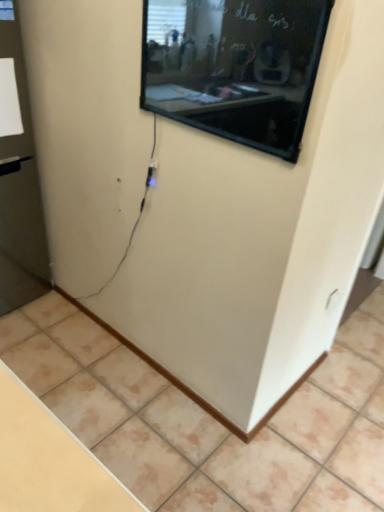
This screenshot has height=512, width=384. Describe the element at coordinates (20, 196) in the screenshot. I see `transparent glass door at left` at that location.

In order to face black glossy screen at upper center, should I rotate leftwards or rightwards?

To face it directly, rotate right by 2.546 degrees.

The width and height of the screenshot is (384, 512). I want to click on transparent glass door at left, so click(x=20, y=196).

Can black glossy screen at upper center be found inside transparent glass door at left?

No, black glossy screen at upper center is not surrounded by transparent glass door at left.

In the scene shown: Can you tell me how much transparent glass door at left and black glossy screen at upper center differ in facing direction?

They differ by 88.2 degrees in their facing directions.

From a real-world perspective, is transparent glass door at left above or below black glossy screen at upper center?

In terms of real-world spatial position, transparent glass door at left is below black glossy screen at upper center.

Does transparent glass door at left have a lesser width compared to black glossy screen at upper center?

No, transparent glass door at left is not thinner than black glossy screen at upper center.

Which of these two, black glossy screen at upper center or transparent glass door at left, is smaller?

Smaller between the two is black glossy screen at upper center.

From the image's perspective, between black glossy screen at upper center and transparent glass door at left, who is located below?

transparent glass door at left, from the image's perspective.

Is black glossy screen at upper center not inside transparent glass door at left?

Yes, black glossy screen at upper center is not within transparent glass door at left.

Does point (216, 65) lie in front of point (2, 247)?

Yes.

Considering the relative positions of black glossy screen at upper center and beige tile at lower center in the image provided, is black glossy screen at upper center in front of beige tile at lower center?

Yes, black glossy screen at upper center is closer to the viewer.

Is point (250, 11) more distant than point (194, 419)?

No, (250, 11) is in front of (194, 419).

Would you say black glossy screen at upper center contains beige tile at lower center?

No, beige tile at lower center is not inside black glossy screen at upper center.

Looking at this image, is black glossy screen at upper center taller or shorter than beige tile at lower center?

black glossy screen at upper center is taller than beige tile at lower center.

Does point (80, 405) come farther from viewer compared to point (10, 169)?

No.

Is beige tile at lower center next to transparent glass door at left?

beige tile at lower center is not next to transparent glass door at left, and they're not touching.

Measure the distance from beige tile at lower center to transparent glass door at left.

The distance of beige tile at lower center from transparent glass door at left is 35.17 inches.

Locate an element on the screen. This screenshot has height=512, width=384. glass door behind the beige tile at lower center is located at coordinates (20, 196).

From the image's perspective, is transparent glass door at left beneath beige tile at lower center?

Incorrect, from the image's perspective, transparent glass door at left is higher than beige tile at lower center.

How far apart are transparent glass door at left and beige tile at lower center?

transparent glass door at left and beige tile at lower center are 35.17 inches apart from each other.

From a real-world perspective, who is located lower, transparent glass door at left or beige tile at lower center?

From a 3D spatial view, beige tile at lower center is below.

Is transparent glass door at left not close to beige tile at lower center?

Actually, transparent glass door at left and beige tile at lower center are a little close together.

From the image's perspective, which is above, beige tile at lower center or black glossy screen at upper center?

black glossy screen at upper center appears higher in the image.

Can you confirm if beige tile at lower center is wider than black glossy screen at upper center?

Yes.

Between beige tile at lower center and black glossy screen at upper center, which one is positioned in front?

black glossy screen at upper center.

Is beige tile at lower center positioned beyond the bounds of black glossy screen at upper center?

Indeed, beige tile at lower center is completely outside black glossy screen at upper center.

Find the location of `glass door on the left of black glossy screen at upper center`. glass door on the left of black glossy screen at upper center is located at coordinates (20, 196).

This screenshot has width=384, height=512. In order to click on projection screen that appears above the transparent glass door at left (from the image's perspective) in this screenshot , I will do `click(235, 67)`.

Considering their positions, is beige tile at lower center positioned closer to transparent glass door at left than black glossy screen at upper center?

beige tile at lower center lies closer to transparent glass door at left than the other object.

Estimate the real-world distances between objects in this image. Which object is closer to beige tile at lower center, transparent glass door at left or black glossy screen at upper center?

The object closer to beige tile at lower center is transparent glass door at left.

Looking at this image, estimate the real-world distances between objects in this image. Which object is further from black glossy screen at upper center, transparent glass door at left or beige tile at lower center?

beige tile at lower center lies further to black glossy screen at upper center than the other object.

From the image, which object appears to be nearer to black glossy screen at upper center, beige tile at lower center or transparent glass door at left?

transparent glass door at left is positioned closer to the anchor black glossy screen at upper center.

When comparing their distances from transparent glass door at left, does black glossy screen at upper center or beige tile at lower center seem closer?

beige tile at lower center lies closer to transparent glass door at left than the other object.

Considering their positions, is black glossy screen at upper center positioned closer to beige tile at lower center than transparent glass door at left?

transparent glass door at left.

At what (x,y) coordinates should I click in order to perform the action: click on projection screen between transparent glass door at left and beige tile at lower center. Please return your answer as a coordinate pair (x, y). This screenshot has width=384, height=512. Looking at the image, I should click on (235, 67).